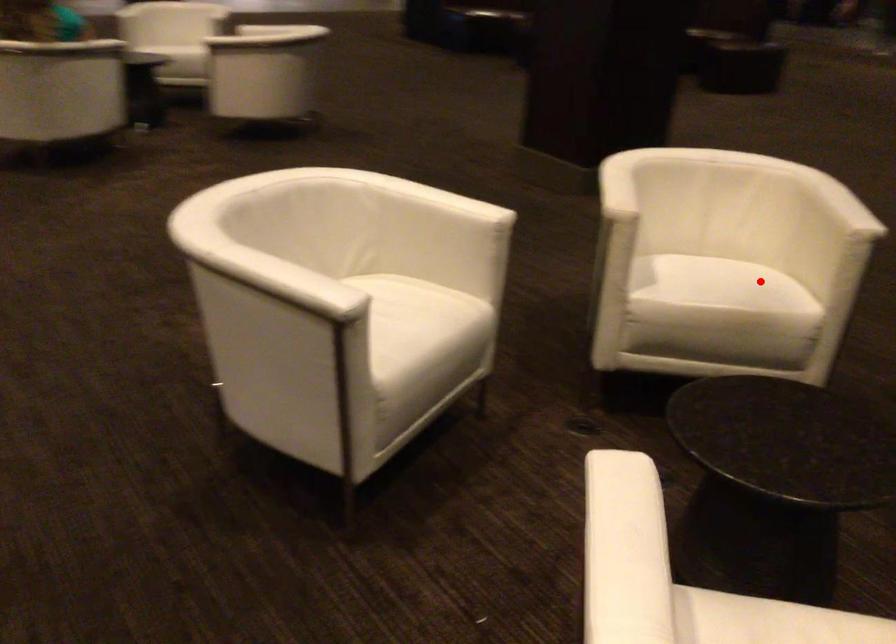
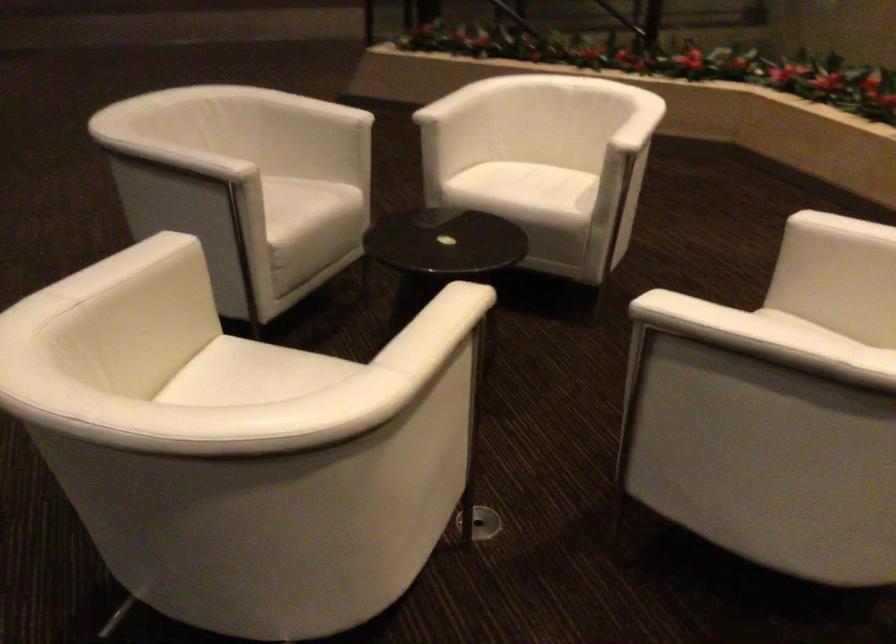
Where in the second image is the point corresponding to the highlighted location from the first image?

(252, 375)